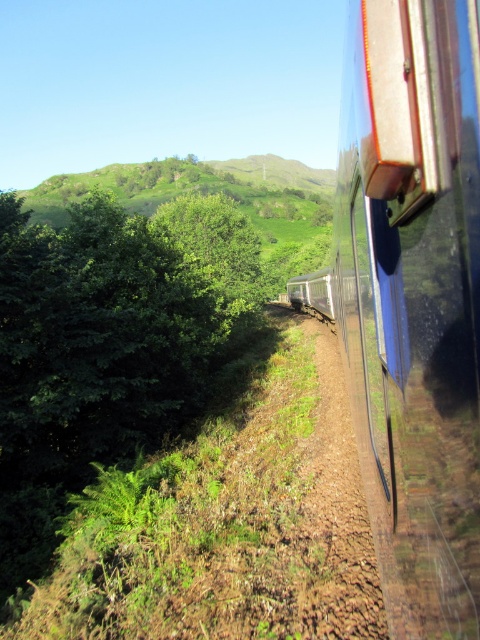
Is glossy metallic train at right smaller than brown gravel dirt track at right?

Incorrect, glossy metallic train at right is not smaller in size than brown gravel dirt track at right.

Does glossy metallic train at right have a lesser width compared to brown gravel dirt track at right?

Indeed, glossy metallic train at right has a lesser width compared to brown gravel dirt track at right.

Between point (412, 268) and point (354, 616), which one is positioned in front?

Positioned in front is point (412, 268).

The height and width of the screenshot is (640, 480). I want to click on glossy metallic train at right, so click(414, 298).